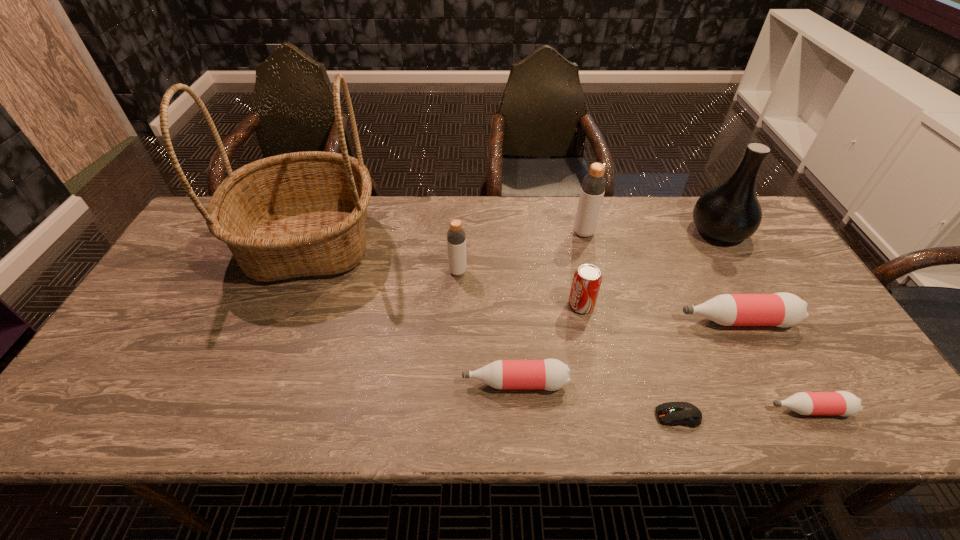
At what (x,y) coordinates should I click in order to perform the action: click on free spot located on the left of the soda can. Please return your answer as a coordinate pair (x, y). Looking at the image, I should click on (478, 305).

This screenshot has height=540, width=960. Find the location of `free space located 0.260m with the cap open on the farthest pink bottle`. free space located 0.260m with the cap open on the farthest pink bottle is located at coordinates (577, 321).

At what (x,y) coordinates should I click in order to perform the action: click on vacant space situated with the cap open on the farthest pink bottle. Please return your answer as a coordinate pair (x, y). This screenshot has height=540, width=960. Looking at the image, I should click on (659, 321).

At what (x,y) coordinates should I click in order to perform the action: click on free point located with the cap open on the farthest pink bottle. Please return your answer as a coordinate pair (x, y). Looking at the image, I should click on (x=632, y=321).

The height and width of the screenshot is (540, 960). I want to click on vacant position located 0.110m with the cap open on the fourth tallest bottle, so click(x=415, y=383).

At what (x,y) coordinates should I click in order to perform the action: click on blank space located 0.290m with the cap open on the fourth tallest bottle. Please return your answer as a coordinate pair (x, y). Image resolution: width=960 pixels, height=540 pixels. Looking at the image, I should click on (336, 383).

Locate an element on the screen. vacant region located 0.170m with the cap open on the fourth tallest bottle is located at coordinates (388, 383).

Identify the location of free space located 0.340m with the cap open on the nearest bottle. (612, 409).

At what (x,y) coordinates should I click in order to perform the action: click on free spot located with the cap open on the nearest bottle. Please return your answer as a coordinate pair (x, y). This screenshot has height=540, width=960. Looking at the image, I should click on (631, 409).

The width and height of the screenshot is (960, 540). Identify the location of vacant area situated 0.090m with the cap open on the nearest bottle. (727, 409).